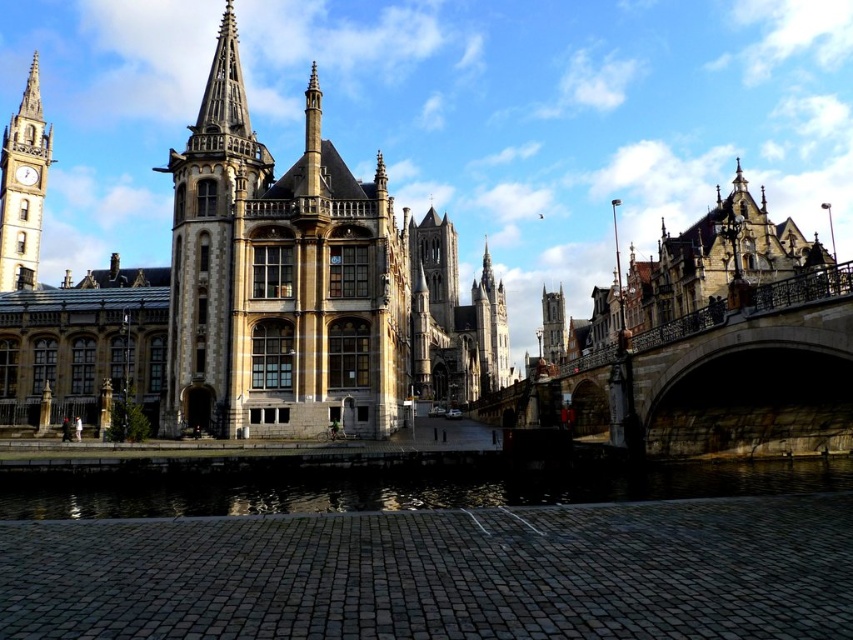
Question: Which point is farther to the camera?

Choices:
 (A) wooden clock at left
 (B) golden stone spire at center

Answer: (B)

Question: Is the position of stone steeple at center less distant than that of smooth stone tower at center?

Choices:
 (A) yes
 (B) no

Answer: (A)

Question: Is black reflective water at lower center closer to camera compared to smooth stone tower at center?

Choices:
 (A) no
 (B) yes

Answer: (B)

Question: Which object appears farthest from the camera in this image?

Choices:
 (A) smooth stone tower at center
 (B) dark stone bridge at right
 (C) stone gothic palace at center
 (D) smooth stone clock tower at left

Answer: (A)

Question: Where is smooth stone clock tower at left located in relation to golden stone spire at center in the image?

Choices:
 (A) above
 (B) below

Answer: (A)

Question: Which object is closer to the camera taking this photo?

Choices:
 (A) stone steeple at center
 (B) smooth stone tower at center

Answer: (A)